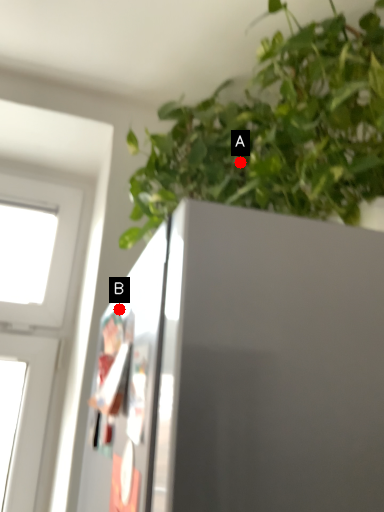
Question: Two points are circled on the image, labeled by A and B beside each circle. Which point appears closest to the camera in this image?

Choices:
 (A) A is closer
 (B) B is closer

Answer: (B)